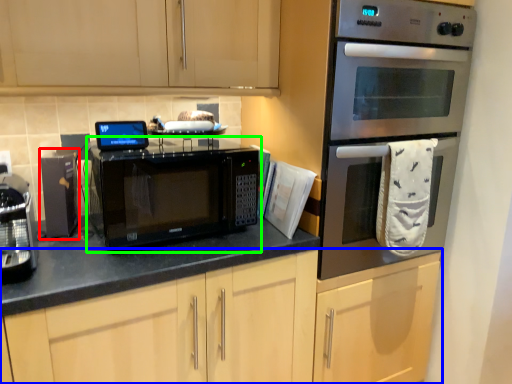
Question: Estimate the real-world distances between objects in this image. Which object is closer to appliance (highlighted by a red box), cabinetry (highlighted by a blue box) or microwave oven (highlighted by a green box)?

Choices:
 (A) cabinetry
 (B) microwave oven

Answer: (B)